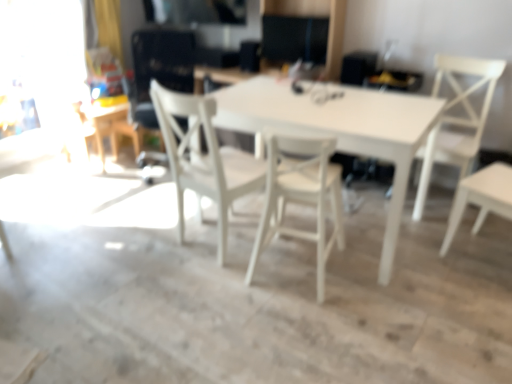
I want to click on free space to the left of white matte table at center, marked as the second table in a left-to-right arrangement, so click(129, 245).